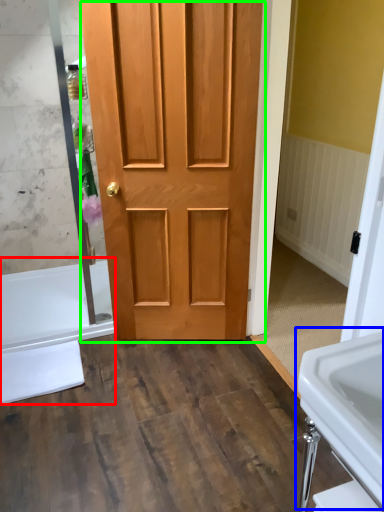
Question: Considering the real-world distances, which object is farthest from bath (highlighted by a red box)? sink (highlighted by a blue box) or door (highlighted by a green box)?

Choices:
 (A) sink
 (B) door

Answer: (A)